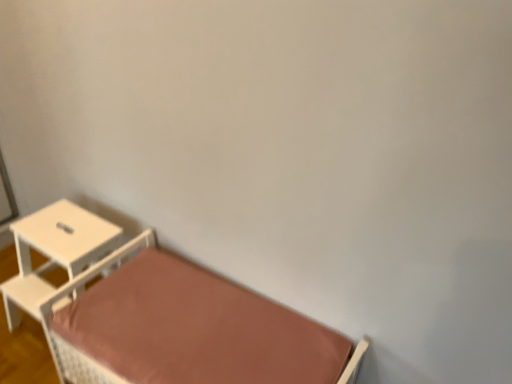
Describe the element at coordinates (185, 329) in the screenshot. This screenshot has width=512, height=384. I see `matte brown bed at lower left` at that location.

The height and width of the screenshot is (384, 512). Find the location of `matte brown bed at lower left`. matte brown bed at lower left is located at coordinates [x=185, y=329].

Identify the location of matte brown bed at lower left. The image size is (512, 384). (185, 329).